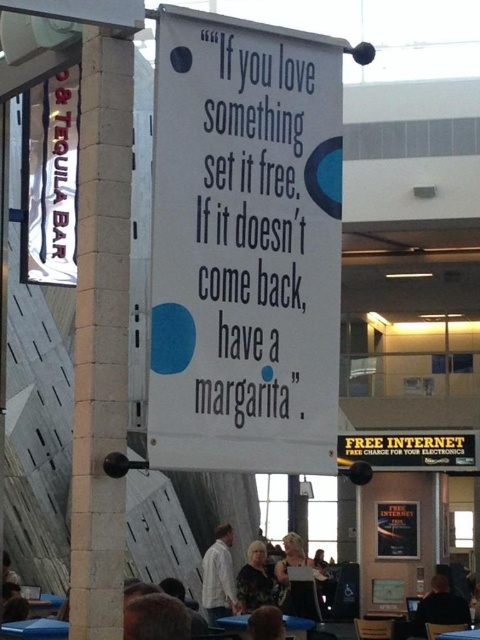
Question: Does white brick pillar at left have a greater width compared to white fabric sign at left?

Choices:
 (A) yes
 (B) no

Answer: (A)

Question: Estimate the real-world distances between objects in this image. Which object is farther from the smooth skin head at lower center?

Choices:
 (A) white fabric sign at left
 (B) yellow paper sign at center
 (C) floral dress at center

Answer: (C)

Question: Can you confirm if white paper sign at center is positioned above dark hair at lower right?

Choices:
 (A) no
 (B) yes

Answer: (B)

Question: Among these objects, which one is nearest to the camera?

Choices:
 (A) floral-patterned blouse at center
 (B) smooth skin head at lower center
 (C) white shirt at center

Answer: (B)

Question: Which object is positioned closest to the floral dress at center?

Choices:
 (A) yellow paper sign at center
 (B) white fabric sign at left
 (C) dark hair at lower right
 (D) floral-patterned blouse at center

Answer: (D)

Question: Is floral-patterned blouse at center closer to the viewer compared to smooth skin head at lower center?

Choices:
 (A) no
 (B) yes

Answer: (A)